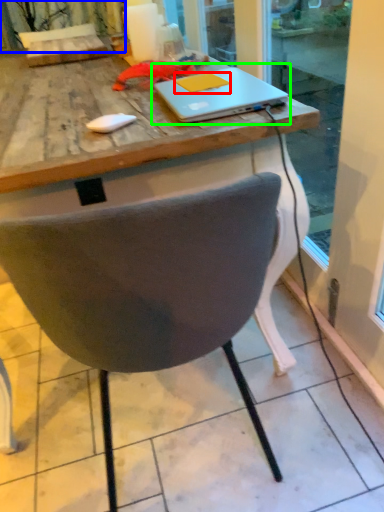
Question: Which is farther away from notepad (highlighted by a red box)? curtain (highlighted by a blue box) or laptop (highlighted by a green box)?

Choices:
 (A) curtain
 (B) laptop

Answer: (A)